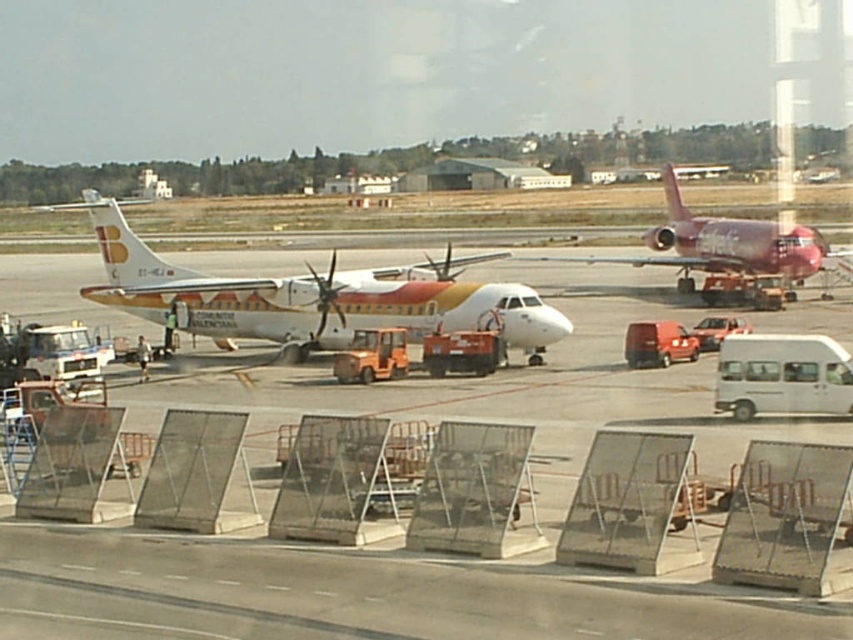
Question: Is the position of white glossy airplane at center more distant than that of shiny red airplane at center?

Choices:
 (A) no
 (B) yes

Answer: (A)

Question: Does white glossy tarmac at center have a lesser width compared to shiny red airplane at center?

Choices:
 (A) yes
 (B) no

Answer: (B)

Question: Which of the following is the closest to the observer?

Choices:
 (A) (126, 257)
 (B) (556, 397)

Answer: (B)

Question: Which object appears farthest from the camera in this image?

Choices:
 (A) shiny red airplane at center
 (B) white glossy tarmac at center

Answer: (A)

Question: Is white glossy airplane at center positioned behind shiny red airplane at center?

Choices:
 (A) no
 (B) yes

Answer: (A)

Question: Which of these objects is positioned farthest from the white glossy airplane at center?

Choices:
 (A) shiny red airplane at center
 (B) white glossy tarmac at center

Answer: (A)